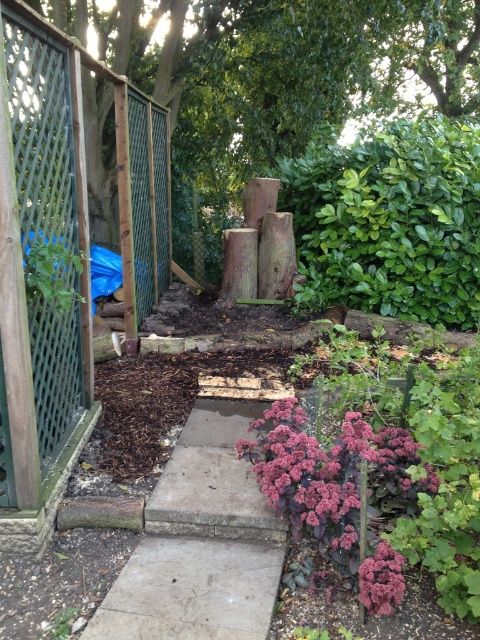
You are a gardener who wants to plant a new flower that needs to be placed at the same height as the purple matte flower at lower center. The smooth concrete path at center is in the way. How can you adjust the planting position to ensure the new flower is at the correct height?

Since the smooth concrete path at center is much taller than the purple matte flower at lower center, you should plant the new flower at the same level as the purple matte flower at lower center, which is lower than the path. This means placing it either beside or behind the path where the ground is at the desired height.

You are a gardener with a wheelbarrow that is 2 meters wide. You need to move from the green lattice fence at left to the smooth concrete path at center. Can your wheelbarrow fit through the space between them?

The space between the green lattice fence at left and the smooth concrete path at center is 2.08 meters. Since your wheelbarrow is 2 meters wide, it can fit through the space as there is enough clearance.

You are planning to place a large garden ornament that requires a space of at least 3 meters in width. Based on the scene, which object between the green lattice fence at left and the smooth concrete path at center would be more suitable for placing the ornament?

The green lattice fence at left has a larger size compared to the smooth concrete path at center, so it would be more suitable for placing the large garden ornament requiring at least 3 meters in width.